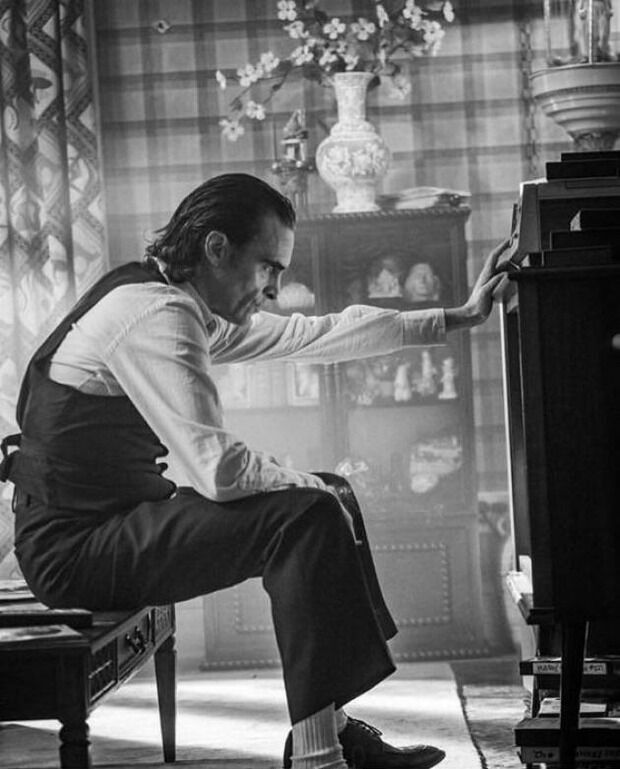
Where is `carpet`? carpet is located at coordinates (250, 727).